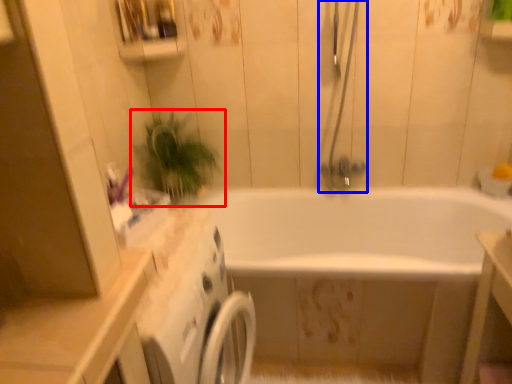
Question: Among these objects, which one is farthest to the camera, houseplant (highlighted by a red box) or shower door (highlighted by a blue box)?

Choices:
 (A) houseplant
 (B) shower door

Answer: (A)